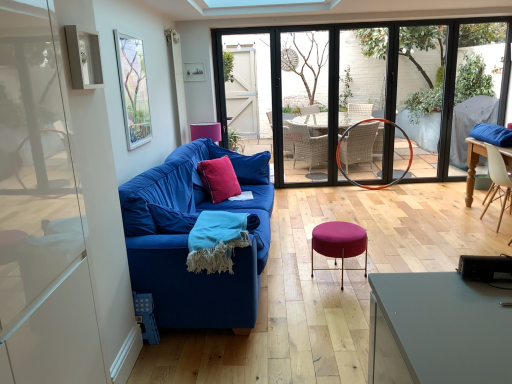
Question: Does blue fabric couch at left have a smaller size compared to clear glass window at center?

Choices:
 (A) no
 (B) yes

Answer: (A)

Question: Considering the relative sizes of blue fabric couch at left and clear glass window at center in the image provided, is blue fabric couch at left shorter than clear glass window at center?

Choices:
 (A) no
 (B) yes

Answer: (B)

Question: Is blue fabric couch at left outside of clear glass window at center?

Choices:
 (A) no
 (B) yes

Answer: (B)

Question: From the image's perspective, is blue fabric couch at left on clear glass window at center?

Choices:
 (A) yes
 (B) no

Answer: (B)

Question: Is blue fabric couch at left positioned before clear glass window at center?

Choices:
 (A) no
 (B) yes

Answer: (B)

Question: From a real-world perspective, is blue fabric couch at left positioned under clear glass window at center based on gravity?

Choices:
 (A) yes
 (B) no

Answer: (A)

Question: Considering the relative positions of transparent glass door at center, which is counted as the second glass door, starting from the left, and white wood chair at right in the image provided, is transparent glass door at center, which is counted as the second glass door, starting from the left, in front of white wood chair at right?

Choices:
 (A) yes
 (B) no

Answer: (B)

Question: Can you confirm if transparent glass door at center, arranged as the 1th glass door when viewed from the right, is thinner than white wood chair at right?

Choices:
 (A) yes
 (B) no

Answer: (A)

Question: From the image's perspective, does transparent glass door at center, which is counted as the second glass door, starting from the left, appear higher than white wood chair at right?

Choices:
 (A) no
 (B) yes

Answer: (B)

Question: Are transparent glass door at center, arranged as the 1th glass door when viewed from the right, and white wood chair at right far apart?

Choices:
 (A) no
 (B) yes

Answer: (B)

Question: Is transparent glass door at center, which is counted as the second glass door, starting from the left, shorter than white wood chair at right?

Choices:
 (A) yes
 (B) no

Answer: (B)

Question: Does transparent glass door at center, which is counted as the second glass door, starting from the left, have a greater width compared to white wood chair at right?

Choices:
 (A) no
 (B) yes

Answer: (A)

Question: Is blue fabric couch at left oriented towards white wood chair at right?

Choices:
 (A) no
 (B) yes

Answer: (B)